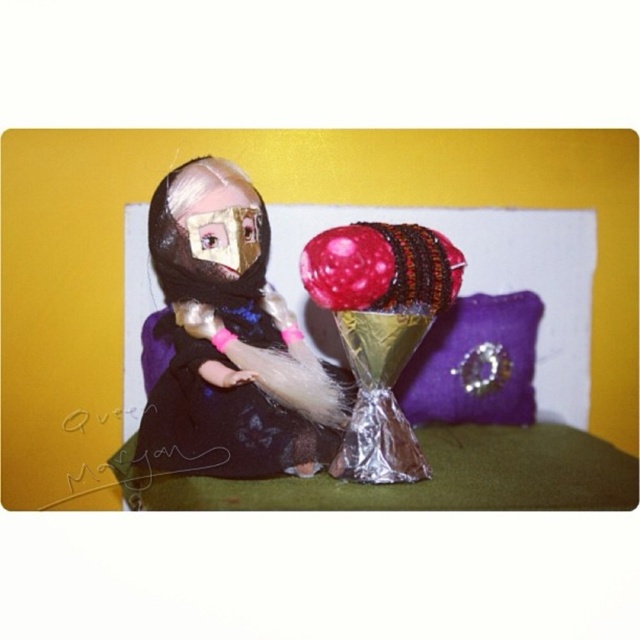
You are planning to gift a present to a friend. You have two options from the image shown. The shiny metallic chocolate at center and the purple velvet pillow at center. Which one is bigger in size?

The shiny metallic chocolate at center is bigger in size compared to the purple velvet pillow at center according to the description.

You are a guest at a party and see the doll figure dressed in dark clothing with a headscarf and the point marked at coordinates (433, 426). Which object is closer to the center of the image?

The point marked at coordinates (433, 426) is the purple fabric bed at center, so it is closer to the center of the image than the doll figure dressed in dark clothing with a headscarf.

Based on the photo, you are a delivery robot with a 4 inch wide package. You need to place the package between the purple fabric bed at center and the shiny metallic chocolate at center. Is there enough space between them to fit your package?

The purple fabric bed at center and shiny metallic chocolate at center are 6.80 inches apart from each other, so yes, the 4 inch wide package can fit between them since the space is wider than the package.